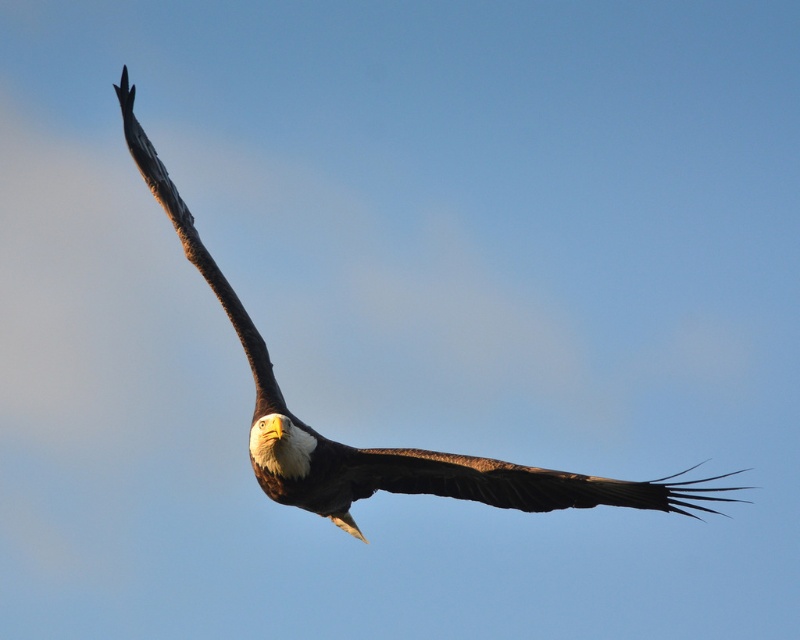
Question: From the image, what is the correct spatial relationship of brown feathered eagle at upper left in relation to brown textured wing at upper left?

Choices:
 (A) above
 (B) below

Answer: (A)

Question: Where is brown feathered eagle at upper left located in relation to brown feathered wing at upper center in the image?

Choices:
 (A) below
 (B) above

Answer: (B)

Question: Which object is closer to the camera taking this photo?

Choices:
 (A) brown feathered eagle at upper left
 (B) brown textured wing at upper left
 (C) brown feathered wing at upper center

Answer: (C)

Question: Which point appears closest to the camera in this image?

Choices:
 (A) (260, 385)
 (B) (584, 486)

Answer: (B)

Question: Which object is positioned farthest from the brown feathered wing at upper center?

Choices:
 (A) brown feathered eagle at upper left
 (B) brown textured wing at upper left

Answer: (A)

Question: Does brown feathered wing at upper center have a greater width compared to brown textured wing at upper left?

Choices:
 (A) yes
 (B) no

Answer: (A)